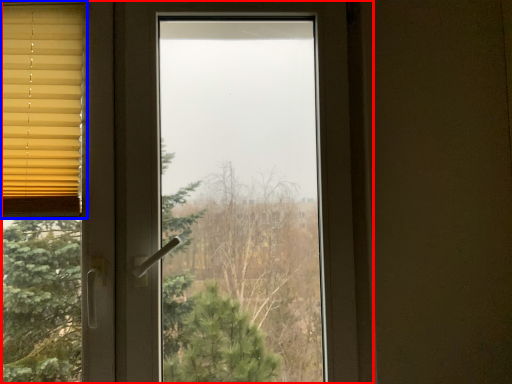
Question: Among these objects, which one is farthest to the camera, window (highlighted by a red box) or window blind (highlighted by a blue box)?

Choices:
 (A) window
 (B) window blind

Answer: (B)